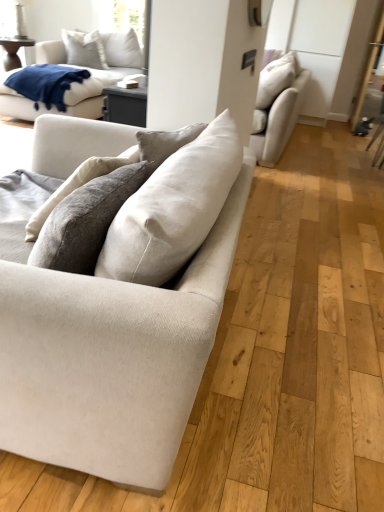
Question: Does white matte cabinet at upper right have a smaller size compared to blue soft fabric blanket at upper left?

Choices:
 (A) yes
 (B) no

Answer: (B)

Question: Is white matte cabinet at upper right positioned far away from blue soft fabric blanket at upper left?

Choices:
 (A) no
 (B) yes

Answer: (B)

Question: From a real-world perspective, is white matte cabinet at upper right positioned under blue soft fabric blanket at upper left based on gravity?

Choices:
 (A) yes
 (B) no

Answer: (B)

Question: Does white matte cabinet at upper right lie behind blue soft fabric blanket at upper left?

Choices:
 (A) no
 (B) yes

Answer: (B)

Question: Is blue soft fabric blanket at upper left inside white matte cabinet at upper right?

Choices:
 (A) no
 (B) yes

Answer: (A)

Question: Looking at their shapes, would you say white matte cabinet at upper right is wider or thinner than white cotton pillow at upper left?

Choices:
 (A) wide
 (B) thin

Answer: (A)

Question: Is point (307, 94) positioned closer to the camera than point (74, 31)?

Choices:
 (A) farther
 (B) closer

Answer: (B)

Question: From the image's perspective, is white matte cabinet at upper right located above or below white cotton pillow at upper left?

Choices:
 (A) below
 (B) above

Answer: (A)

Question: From their relative heights in the image, would you say white matte cabinet at upper right is taller or shorter than white cotton pillow at upper left?

Choices:
 (A) tall
 (B) short

Answer: (A)

Question: Looking at the image, does white cotton pillow at upper left seem bigger or smaller compared to beige fabric couch at upper right, placed as the first studio couch when sorted from right to left?

Choices:
 (A) big
 (B) small

Answer: (B)

Question: From a real-world perspective, is white cotton pillow at upper left physically located above or below beige fabric couch at upper right, which is the 2th studio couch from left to right?

Choices:
 (A) below
 (B) above

Answer: (B)

Question: Considering their positions, is white cotton pillow at upper left located in front of or behind beige fabric couch at upper right, placed as the first studio couch when sorted from right to left?

Choices:
 (A) front
 (B) behind

Answer: (B)

Question: Considering the positions of white cotton pillow at upper left and beige fabric couch at upper right, arranged as the first studio couch when viewed from the back, in the image, is white cotton pillow at upper left wider or thinner than beige fabric couch at upper right, arranged as the first studio couch when viewed from the back,?

Choices:
 (A) wide
 (B) thin

Answer: (B)

Question: Does point (284, 137) appear closer or farther from the camera than point (69, 44)?

Choices:
 (A) closer
 (B) farther

Answer: (A)

Question: Based on their positions, is beige fabric couch at upper right, arranged as the first studio couch when viewed from the back, located to the left or right of white cotton pillow at upper left?

Choices:
 (A) right
 (B) left

Answer: (A)